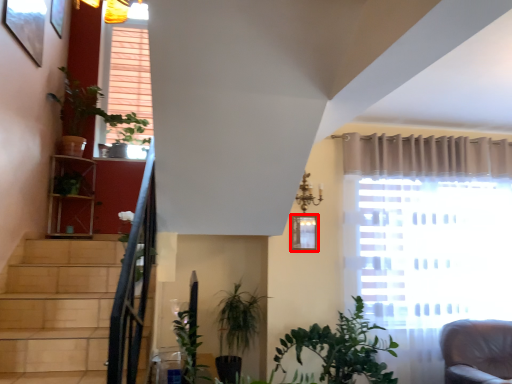
Question: Observing the image, what is the correct spatial positioning of picture frame (annotated by the red box) in reference to plant?

Choices:
 (A) right
 (B) left

Answer: (A)